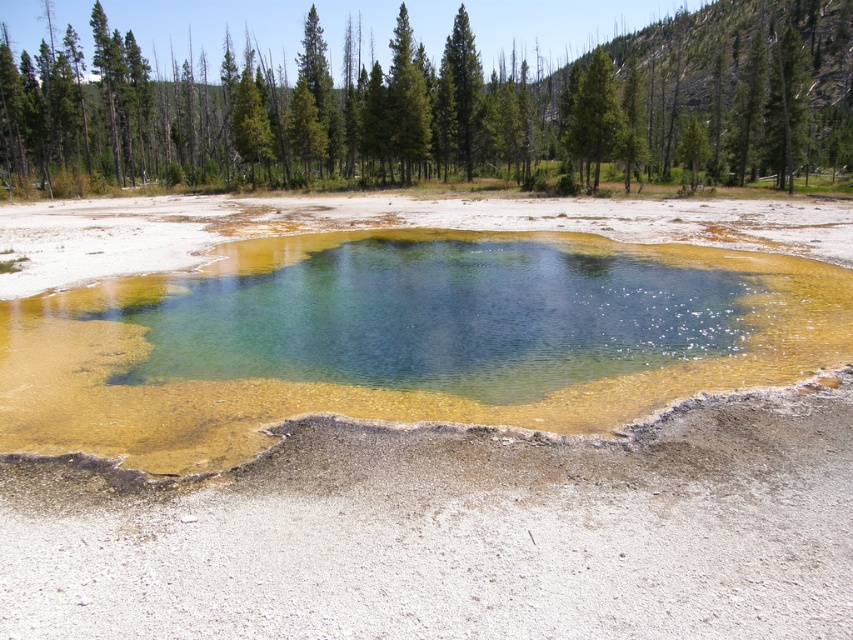
You are a hiker who wants to take a photo of both the green leafy tree at upper center and the green textured tree at upper center. Since you have a camera with a fixed focal length, which tree should you focus on to ensure both are in the frame?

You should focus on the green leafy tree at upper center because it is bigger than the green textured tree at upper center, so centering on it will likely keep both in the frame.